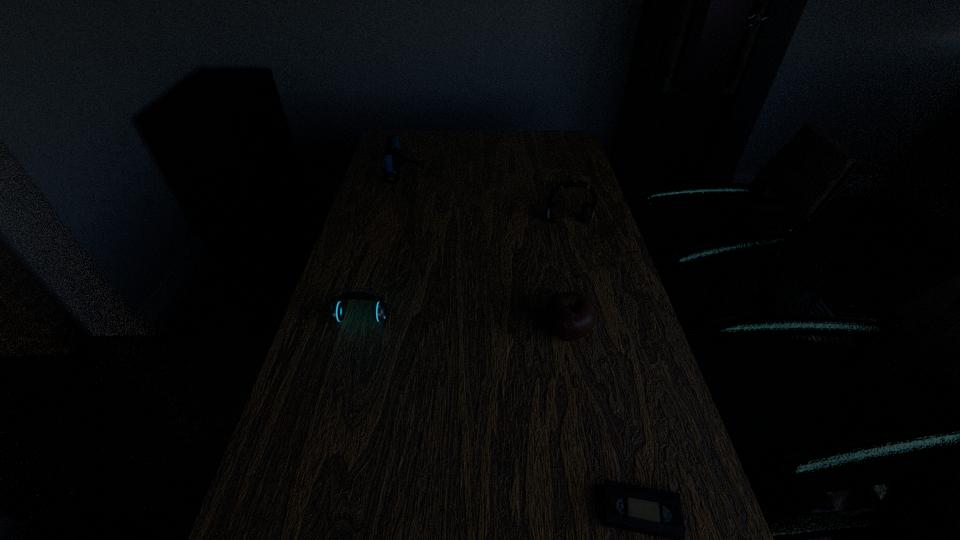
Identify the location of vacant region located 0.100m on the ear cups of the shortest headset. Image resolution: width=960 pixels, height=540 pixels. (350, 360).

In order to click on headset that is at the right edge in this screenshot , I will do `click(587, 212)`.

You are a GUI agent. You are given a task and a screenshot of the screen. Output one action in this format:
    pyautogui.click(x=<x>, y=<y>)
    Task: Click on the apple that is at the right edge
    This screenshot has width=960, height=540.
    Given the screenshot: What is the action you would take?
    pyautogui.click(x=570, y=316)

Locate an element on the screen. Image resolution: width=960 pixels, height=540 pixels. blank space at the far edge of the desktop is located at coordinates (459, 136).

The width and height of the screenshot is (960, 540). In the image, there is a desktop. What are the coordinates of `free space at the left edge` in the screenshot? It's located at (350, 269).

The height and width of the screenshot is (540, 960). Identify the location of vacant space at the right edge of the desktop. (669, 475).

Locate an element on the screen. vacant space in between the nearest headset and the farthest object is located at coordinates (383, 247).

At what (x,y) coordinates should I click in order to perform the action: click on free area in between the shortest headset and the farthest object. Please return your answer as a coordinate pair (x, y). Looking at the image, I should click on (383, 247).

Where is `empty location between the second farthest object and the apple`? This screenshot has width=960, height=540. empty location between the second farthest object and the apple is located at coordinates (567, 277).

This screenshot has width=960, height=540. In order to click on free spot between the farthest headset and the apple in this screenshot , I will do `click(486, 254)`.